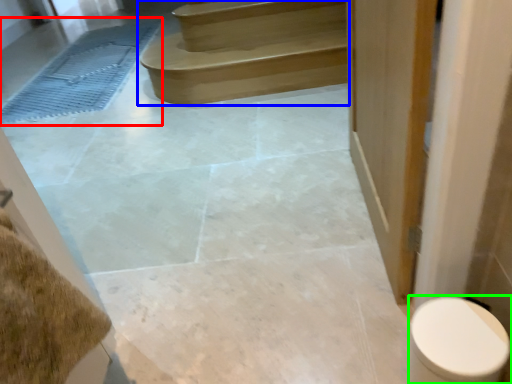
Question: Which is farther away from bath mat (highlighted by a red box)? stairs (highlighted by a blue box) or toilet (highlighted by a green box)?

Choices:
 (A) stairs
 (B) toilet

Answer: (B)